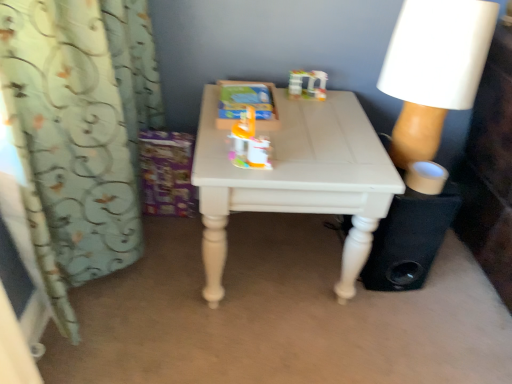
The width and height of the screenshot is (512, 384). Find the location of `free spot below white painted wood table at center (from a real-world perspective)`. free spot below white painted wood table at center (from a real-world perspective) is located at coordinates (278, 265).